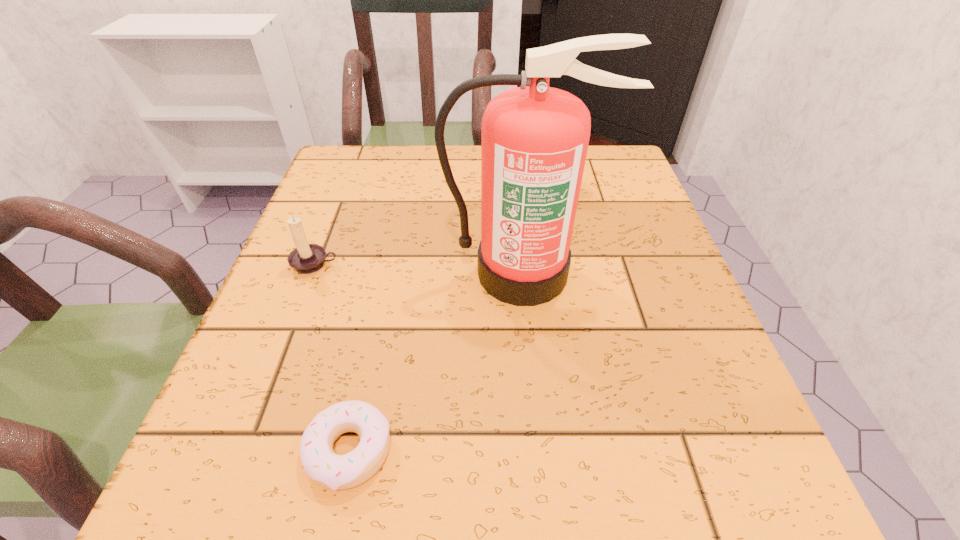
Image resolution: width=960 pixels, height=540 pixels. Find the location of `the rightmost object`. the rightmost object is located at coordinates point(534,139).

At what (x,y) coordinates should I click in order to perform the action: click on fire extinguisher. Please return your answer as a coordinate pair (x, y). The height and width of the screenshot is (540, 960). Looking at the image, I should click on (534, 139).

Find the location of a particular element. the leftmost object is located at coordinates (306, 258).

Image resolution: width=960 pixels, height=540 pixels. What are the coordinates of `the second shortest object` in the screenshot? It's located at (306, 258).

Locate an element on the screen. doughnut is located at coordinates (328, 469).

At what (x,y) coordinates should I click in order to perform the action: click on the nearest object. Please return your answer as a coordinate pair (x, y). The width and height of the screenshot is (960, 540). Looking at the image, I should click on (328, 469).

Where is `vacant area situated at the nozzle of the tallest object`? The height and width of the screenshot is (540, 960). vacant area situated at the nozzle of the tallest object is located at coordinates (543, 472).

Find the location of a particular element. The height and width of the screenshot is (540, 960). free spot located 0.250m on the wick of the leftmost object is located at coordinates (263, 400).

Where is `vacant region located 0.240m on the back of the doughnut`? The width and height of the screenshot is (960, 540). vacant region located 0.240m on the back of the doughnut is located at coordinates (383, 287).

Find the location of `object at the near edge`. object at the near edge is located at coordinates (328, 469).